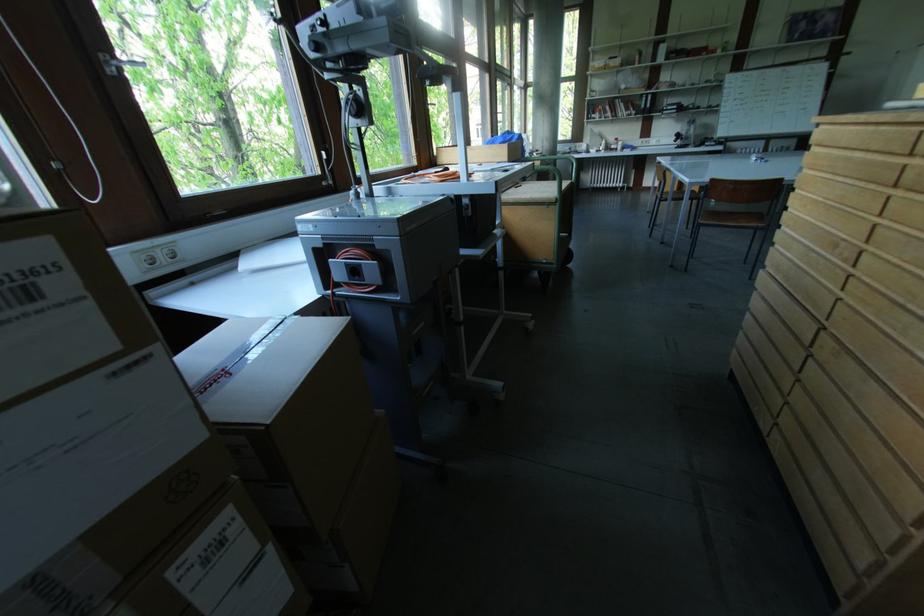
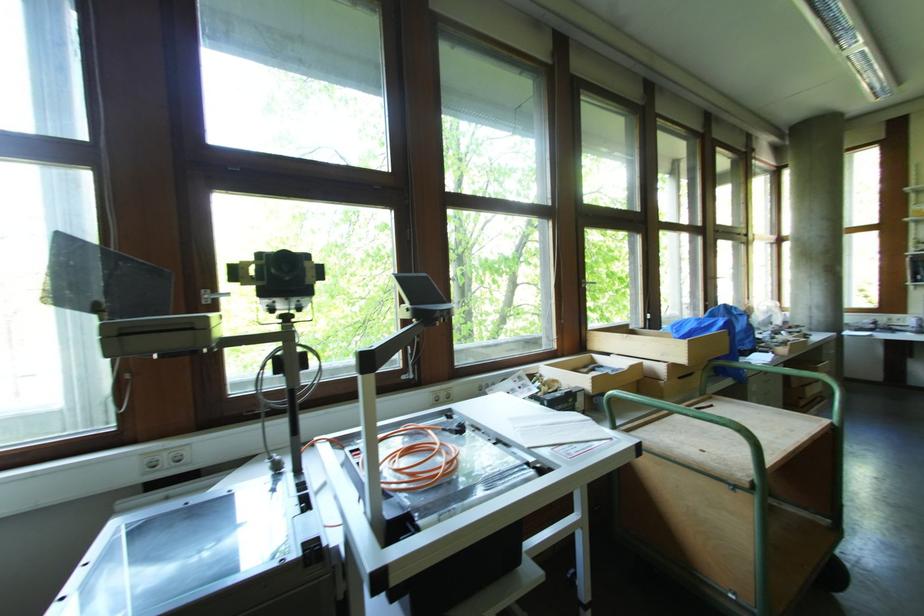
Locate, in the second image, the point that corresponds to the point at 164,261 in the first image.

(168, 464)